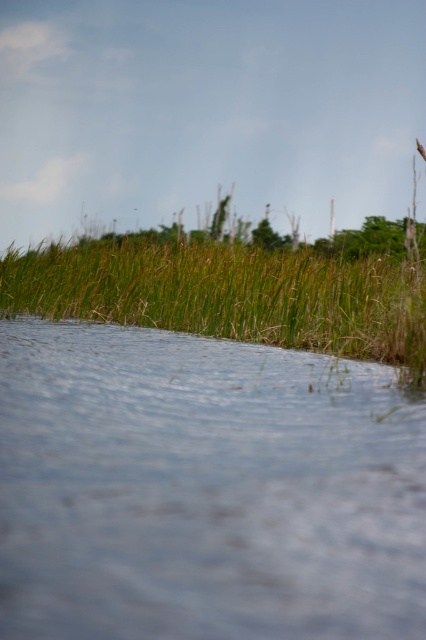
Question: Is clear water at lower center wider than green grass at upper center?

Choices:
 (A) no
 (B) yes

Answer: (A)

Question: Is clear water at lower center positioned in front of green grass at upper center?

Choices:
 (A) yes
 (B) no

Answer: (A)

Question: Is clear water at lower center to the right of green grass at upper center from the viewer's perspective?

Choices:
 (A) yes
 (B) no

Answer: (B)